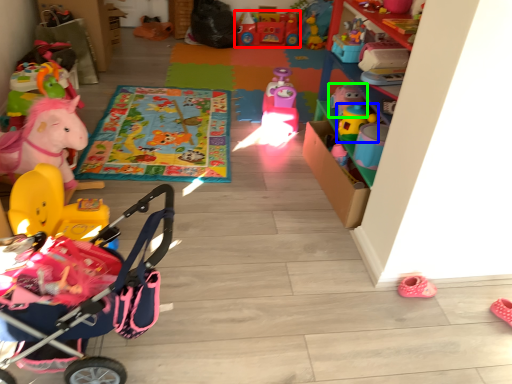
Question: Considering the real-world distances, which object is closest to toy (highlighted by a red box)? toy (highlighted by a blue box) or toy (highlighted by a green box).

Choices:
 (A) toy
 (B) toy

Answer: (B)